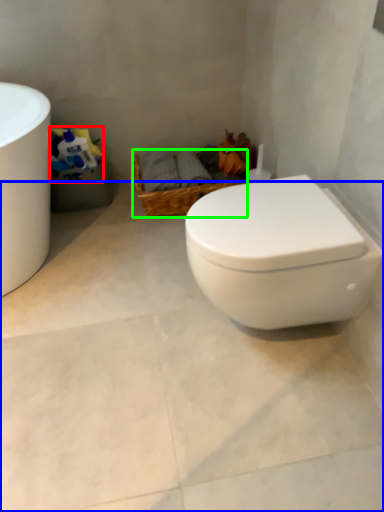
Question: Considering the real-world distances, which object is farthest from toilet paper (highlighted by a red box)? concrete (highlighted by a blue box) or basket (highlighted by a green box)?

Choices:
 (A) concrete
 (B) basket

Answer: (A)